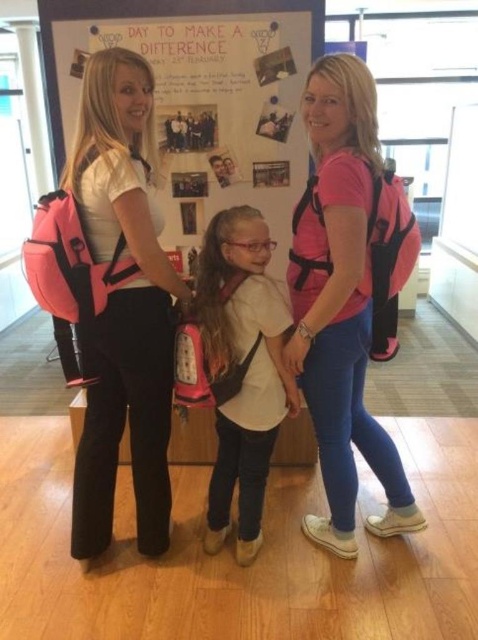
Question: Among these points, which one is nearest to the camera?

Choices:
 (A) (107, 314)
 (B) (224, 275)
 (C) (318, 424)

Answer: (A)

Question: Does matte pink backpack at left lie in front of pink fabric backpack at center?

Choices:
 (A) no
 (B) yes

Answer: (B)

Question: Is pink matte backpack at center wider than matte pink backpack at left?

Choices:
 (A) no
 (B) yes

Answer: (B)

Question: Estimate the real-world distances between objects in this image. Which object is farther from the pink matte backpack at center?

Choices:
 (A) pink fabric backpack at center
 (B) matte pink backpack at left

Answer: (B)

Question: Which object is closer to the camera taking this photo?

Choices:
 (A) pink matte backpack at center
 (B) matte pink backpack at left
 (C) pink fabric backpack at center

Answer: (A)

Question: Can you confirm if matte pink backpack at left is positioned to the right of pink fabric backpack at center?

Choices:
 (A) yes
 (B) no

Answer: (B)